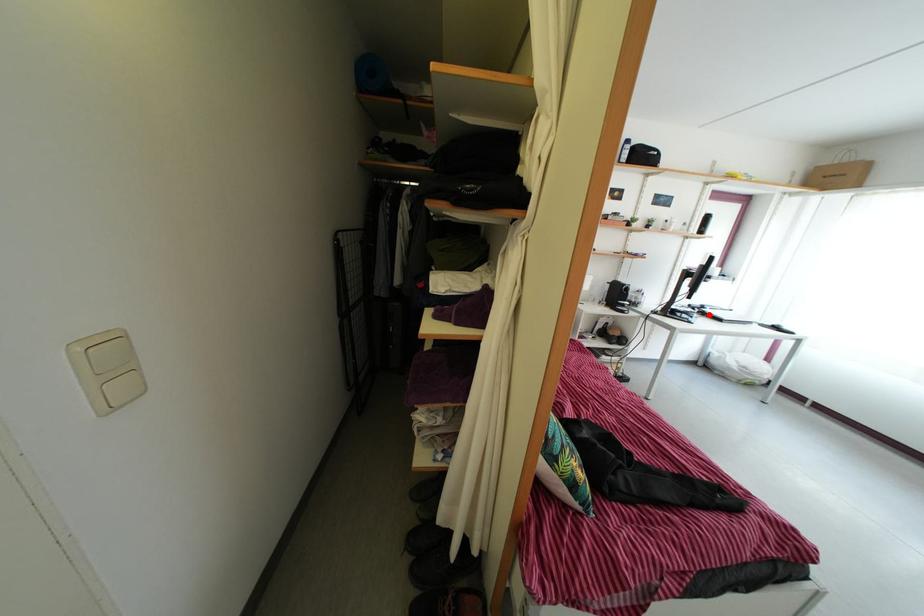
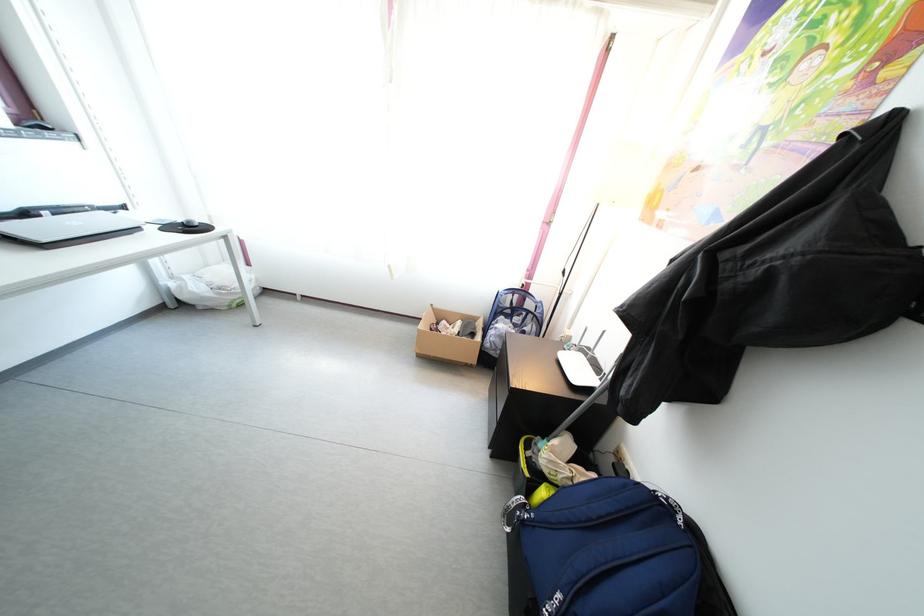
Question: I am providing you with two images of the same scene from different viewpoints. Given a red point in image1, look at the same physical point in image2. Is it:

Choices:
 (A) Closer to the viewpoint
 (B) Farther from the viewpoint

Answer: (B)